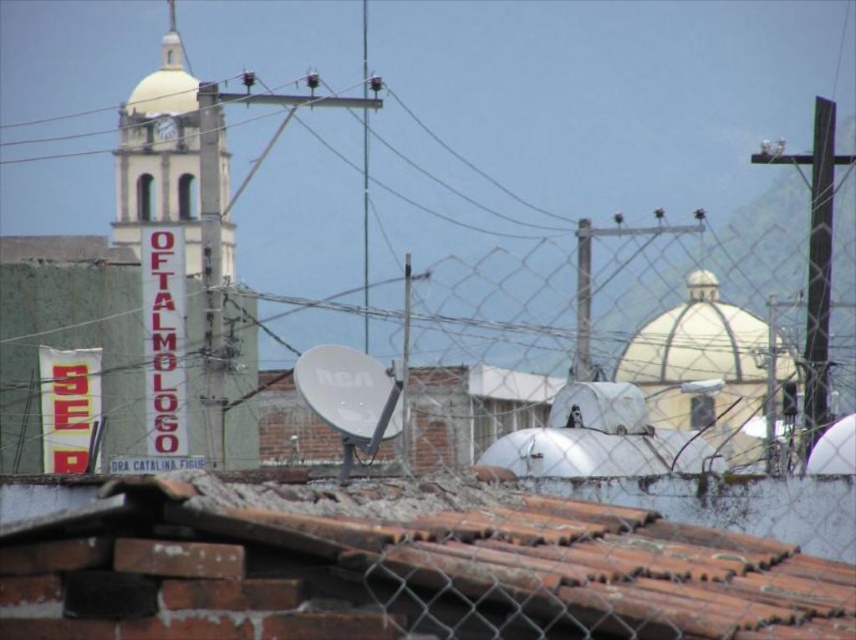
Does metallic pole at center have a greater width compared to white plastic satellite dish at center?

Indeed, metallic pole at center has a greater width compared to white plastic satellite dish at center.

Does metallic pole at center come behind white plastic satellite dish at center?

Yes, it is behind white plastic satellite dish at center.

Is point (575, 378) closer to camera compared to point (409, 260)?

No, it is not.

This screenshot has height=640, width=856. I want to click on metallic pole at center, so click(581, 301).

Who is shorter, white concrete tower at left or metallic pole at center?

metallic pole at center is shorter.

Is point (217, 209) positioned after point (589, 324)?

No.

This screenshot has height=640, width=856. Describe the element at coordinates (211, 268) in the screenshot. I see `white concrete tower at left` at that location.

The height and width of the screenshot is (640, 856). I want to click on white concrete tower at left, so click(211, 268).

Is dark brown wooden pole at right to the right of white concrete tower at left from the viewer's perspective?

Indeed, dark brown wooden pole at right is positioned on the right side of white concrete tower at left.

Is point (813, 200) closer to camera compared to point (212, 456)?

No, it is not.

The height and width of the screenshot is (640, 856). What do you see at coordinates (818, 272) in the screenshot? I see `dark brown wooden pole at right` at bounding box center [818, 272].

Locate an element on the screen. The image size is (856, 640). dark brown wooden pole at right is located at coordinates (818, 272).